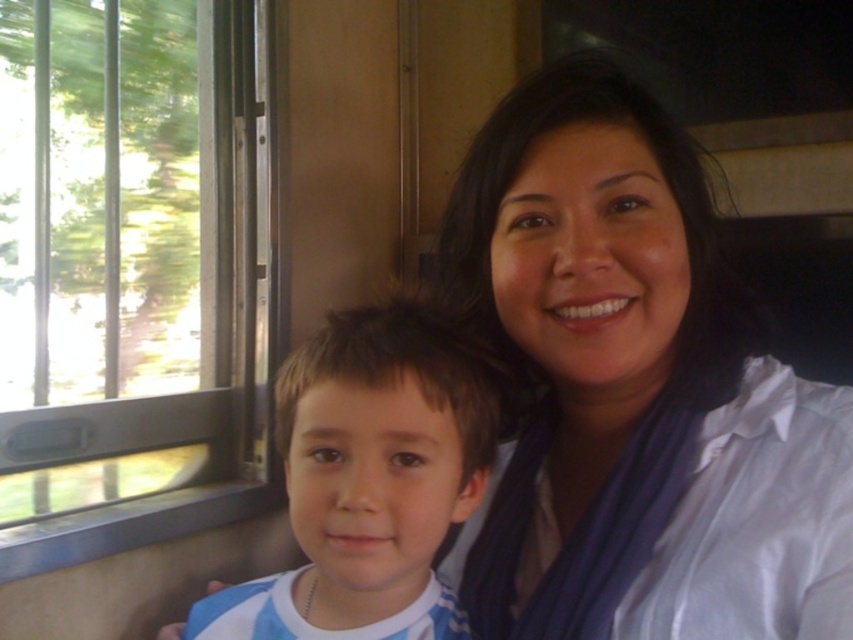
You are a photographer standing in front of the train car scene. You want to take a photo that includes both the adult and the child. The adult is at point (178, 112) and the child is at point (415, 310). Which person is closer to you so that you can focus on them first?

Point (178, 112) is further to the viewer than point (415, 310). Therefore, the adult at point (178, 112) is closer to you than the child at point (415, 310), so you should focus on the adult first.

You are a photographer trying to capture a closeup of the clear glass window at left without including the white satin blouse at upper right in the frame. Given their sizes in the image, is this possible?

The white satin blouse at upper right occupies less space than the clear glass window at left, so it is possible to capture a closeup of the clear glass window at left without including the white satin blouse at upper right in the frame since the blouse is smaller in the image.

From the picture: You are a photographer standing in front of the train car window. You want to take a photo of the white satin blouse at upper right and the blue striped shirt at center. How far apart are these two items in inches?

The white satin blouse at upper right is 5.49 inches away from the blue striped shirt at center.